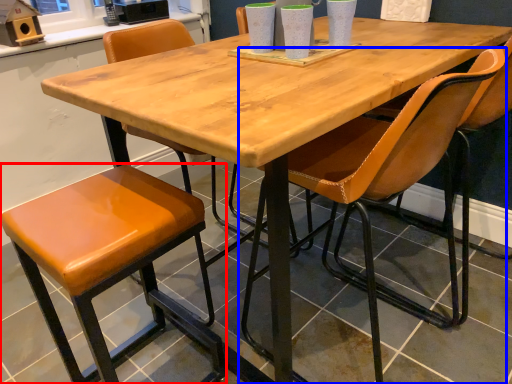
Question: Among these objects, which one is nearest to the camera, stool (highlighted by a red box) or chair (highlighted by a blue box)?

Choices:
 (A) stool
 (B) chair

Answer: (B)